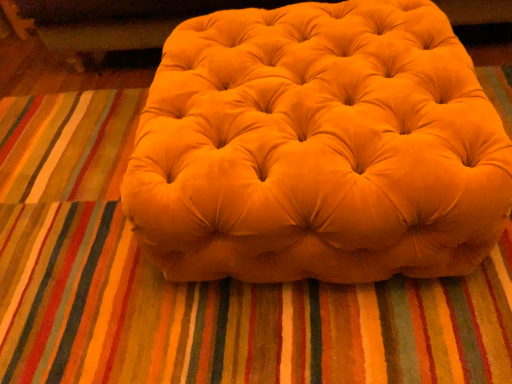
Image resolution: width=512 pixels, height=384 pixels. What do you see at coordinates (318, 148) in the screenshot?
I see `velvet orange ottoman at center` at bounding box center [318, 148].

The height and width of the screenshot is (384, 512). I want to click on velvet orange ottoman at center, so click(x=318, y=148).

This screenshot has height=384, width=512. In order to click on velvet orange ottoman at center in this screenshot , I will do `click(318, 148)`.